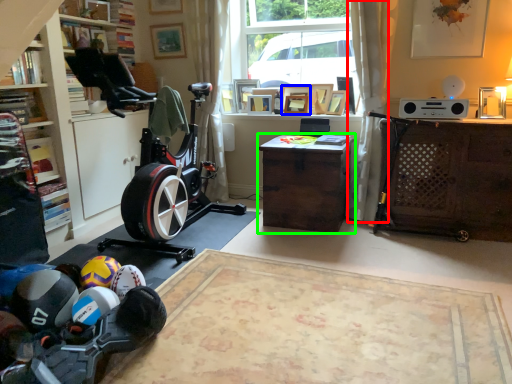
Question: Based on their relative distances, which object is nearer to curtain (highlighted by a red box)? Choose from picture frame (highlighted by a blue box) and desk (highlighted by a green box).

Choices:
 (A) picture frame
 (B) desk

Answer: (B)